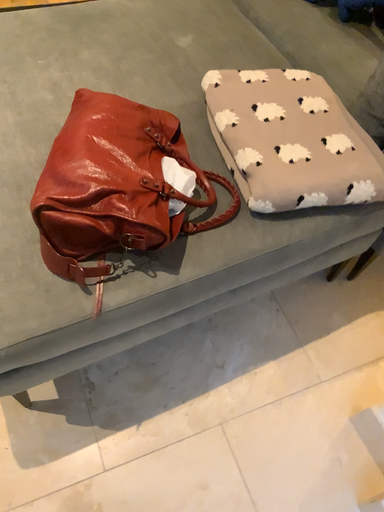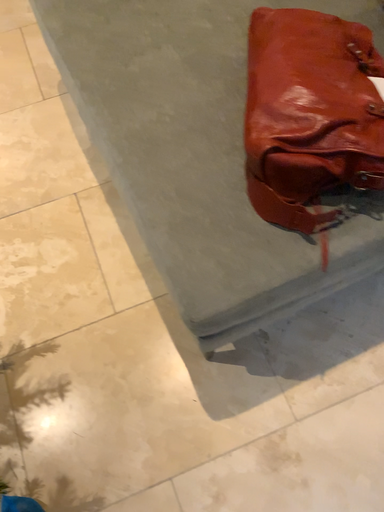
Question: How did the camera likely rotate when shooting the video?

Choices:
 (A) rotated right
 (B) rotated left

Answer: (B)